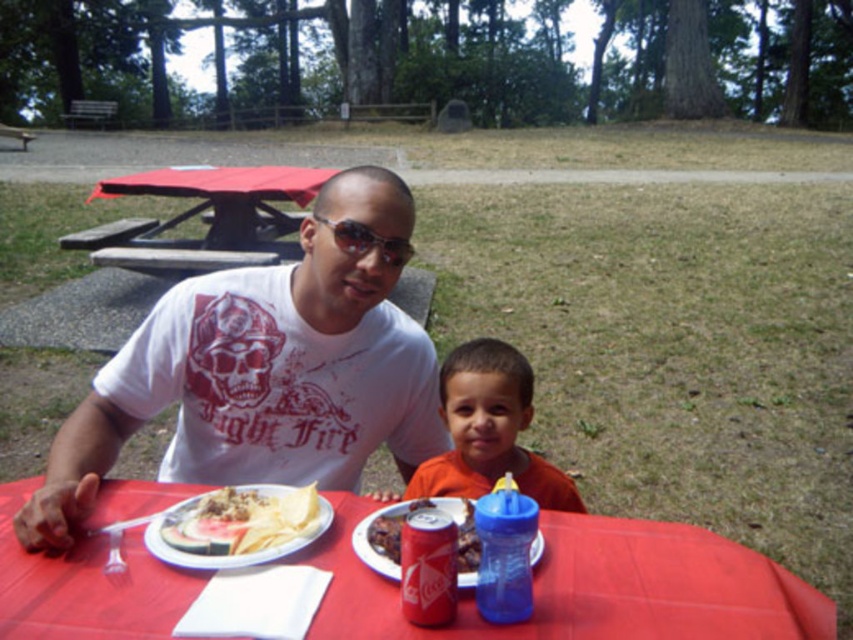
Measure the distance between red matte coca-cola can at center and camera.

red matte coca-cola can at center is 34.14 inches from camera.

Between red matte coca-cola can at center and sunglasses at center, which one is positioned higher?

Positioned higher is sunglasses at center.

The width and height of the screenshot is (853, 640). What are the coordinates of `red matte coca-cola can at center` in the screenshot? It's located at (428, 566).

At what (x,y) coordinates should I click in order to perform the action: click on red matte coca-cola can at center. Please return your answer as a coordinate pair (x, y). Looking at the image, I should click on (428, 566).

Does shiny plastic soda can at center have a smaller size compared to sunglasses at center?

Actually, shiny plastic soda can at center might be larger than sunglasses at center.

Is shiny plastic soda can at center above sunglasses at center?

No.

The width and height of the screenshot is (853, 640). I want to click on shiny plastic soda can at center, so click(x=402, y=524).

Which is behind, point (628, 524) or point (274, 176)?

The point (274, 176) is more distant.

Does red plastic table at center have a lesser height compared to red plastic picnic table at upper left?

Yes, red plastic table at center is shorter than red plastic picnic table at upper left.

The width and height of the screenshot is (853, 640). Identify the location of red plastic table at center. (590, 588).